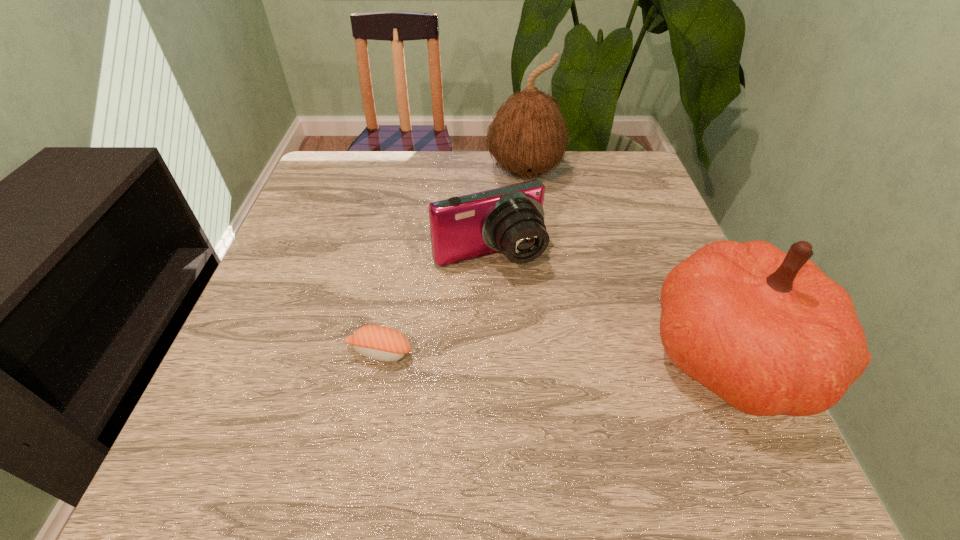
You are a GUI agent. You are given a task and a screenshot of the screen. Output one action in this format:
    pyautogui.click(x=<x>, y=<y>)
    Task: Click on the sushi
    The height and width of the screenshot is (540, 960).
    Given the screenshot: What is the action you would take?
    pyautogui.click(x=377, y=342)

The image size is (960, 540). In order to click on the shortest object in this screenshot , I will do `click(377, 342)`.

This screenshot has width=960, height=540. I want to click on pumpkin, so click(769, 332).

Where is `the second tallest object`? Image resolution: width=960 pixels, height=540 pixels. the second tallest object is located at coordinates (769, 332).

In order to click on coconut in this screenshot , I will do `click(528, 137)`.

Image resolution: width=960 pixels, height=540 pixels. I want to click on the second shortest object, so click(x=510, y=219).

At what (x,y) coordinates should I click in order to perform the action: click on camera. Please return your answer as a coordinate pair (x, y). The width and height of the screenshot is (960, 540). Looking at the image, I should click on (510, 219).

This screenshot has height=540, width=960. Find the location of `vacant space located on the back of the leftmost object`. vacant space located on the back of the leftmost object is located at coordinates (406, 211).

Locate an element on the screen. This screenshot has width=960, height=540. free region located 0.350m on the surface of the coconut is located at coordinates (564, 294).

Identify the location of free region located on the surface of the coconut. (557, 274).